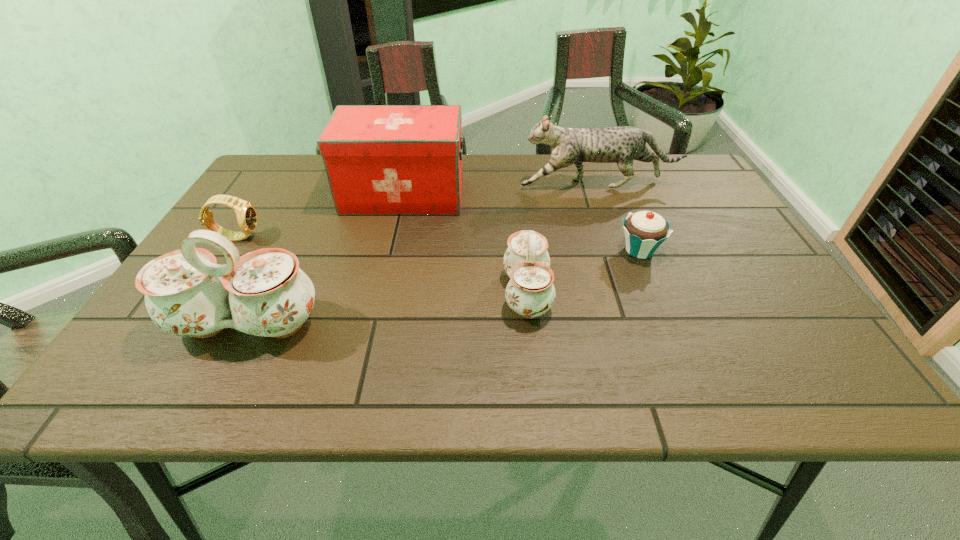
This screenshot has height=540, width=960. Find the location of `vacant point located between the cupcake and the taller chinaware`. vacant point located between the cupcake and the taller chinaware is located at coordinates (444, 287).

You are a GUI agent. You are given a task and a screenshot of the screen. Output one action in this format:
    pyautogui.click(x=<x>, y=<y>)
    Task: Click on the vacant space in between the left chinaware and the cupcake
    The height and width of the screenshot is (540, 960).
    Given the screenshot: What is the action you would take?
    pyautogui.click(x=444, y=287)

At what (x,y) coordinates should I click in order to perform the action: click on vacant region between the fourth tallest object and the cat. Please return your answer as a coordinate pair (x, y). Looking at the image, I should click on (563, 239).

Find the location of a particular element. This screenshot has height=540, width=960. unoccupied position between the cat and the left chinaware is located at coordinates (422, 255).

The image size is (960, 540). I want to click on free space between the right chinaware and the first-aid kit, so click(465, 244).

You are a GUI agent. You are given a task and a screenshot of the screen. Output one action in this format:
    pyautogui.click(x=<x>, y=<y>)
    Task: Click on the vacant space that's between the cupcake and the cat
    The width and height of the screenshot is (960, 540).
    Given the screenshot: What is the action you would take?
    pyautogui.click(x=619, y=218)

At what (x,y) coordinates should I click in order to perform the action: click on the fifth closest object to the watch. Please return your answer as a coordinate pair (x, y). This screenshot has width=960, height=540. Looking at the image, I should click on (645, 231).

The height and width of the screenshot is (540, 960). Find the location of `object that can be found as the third closest to the left chinaware`. object that can be found as the third closest to the left chinaware is located at coordinates (530, 292).

In order to click on free spot that satisfies the following two spatial constraints: 1. on the back side of the cupcake; 2. on the face of the watch in this screenshot , I will do `click(634, 237)`.

Locate an element on the screen. free point that satisfies the following two spatial constraints: 1. on the handle side of the first-aid kit; 2. on the right side of the cupcake is located at coordinates (391, 251).